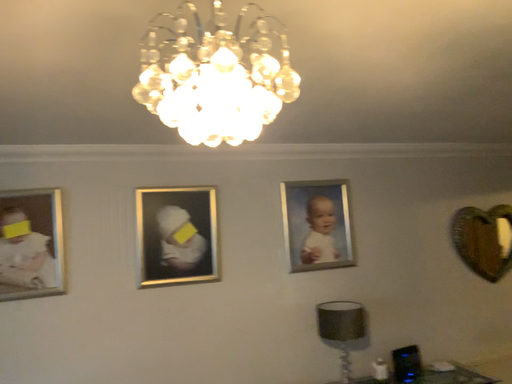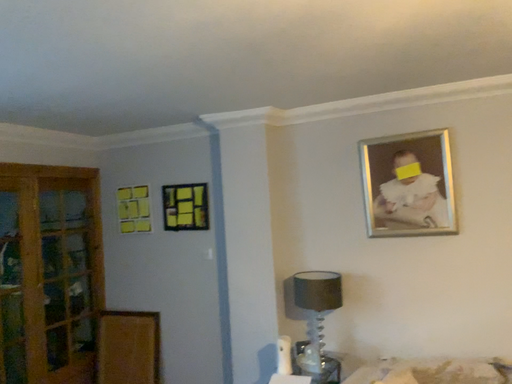
Question: Which way did the camera rotate in the video?

Choices:
 (A) rotated upward
 (B) rotated downward

Answer: (B)